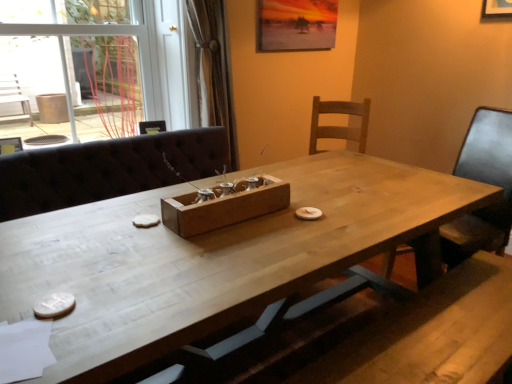
Question: Does transparent glass door at upper left have a lesser height compared to wooden chair at right?

Choices:
 (A) no
 (B) yes

Answer: (B)

Question: Does transparent glass door at upper left lie in front of wooden chair at right?

Choices:
 (A) yes
 (B) no

Answer: (B)

Question: Is transparent glass door at upper left not within wooden chair at right?

Choices:
 (A) no
 (B) yes

Answer: (B)

Question: Is there a large distance between transparent glass door at upper left and wooden chair at right?

Choices:
 (A) no
 (B) yes

Answer: (B)

Question: Does transparent glass door at upper left have a smaller size compared to wooden chair at right?

Choices:
 (A) no
 (B) yes

Answer: (A)

Question: Would you say wooden tray at center is inside or outside transparent glass door at upper left?

Choices:
 (A) outside
 (B) inside

Answer: (A)

Question: Considering their positions, is wooden tray at center located in front of or behind transparent glass door at upper left?

Choices:
 (A) front
 (B) behind

Answer: (A)

Question: Is point (266, 193) closer or farther from the camera than point (160, 23)?

Choices:
 (A) closer
 (B) farther

Answer: (A)

Question: From a real-world perspective, relative to transparent glass door at upper left, is wooden tray at center vertically above or below?

Choices:
 (A) above
 (B) below

Answer: (B)

Question: Does point tap(450, 264) appear closer or farther from the camera than point tap(195, 213)?

Choices:
 (A) farther
 (B) closer

Answer: (A)

Question: Is wooden chair at right to the left or to the right of wooden tray at center in the image?

Choices:
 (A) right
 (B) left

Answer: (A)

Question: From the image's perspective, is wooden chair at right above or below wooden tray at center?

Choices:
 (A) above
 (B) below

Answer: (B)

Question: In terms of height, does wooden chair at right look taller or shorter compared to wooden tray at center?

Choices:
 (A) short
 (B) tall

Answer: (B)

Question: Would you say transparent glass door at upper left is to the left or to the right of white wood table at center in the picture?

Choices:
 (A) left
 (B) right

Answer: (A)

Question: Is transparent glass door at upper left bigger or smaller than white wood table at center?

Choices:
 (A) big
 (B) small

Answer: (B)